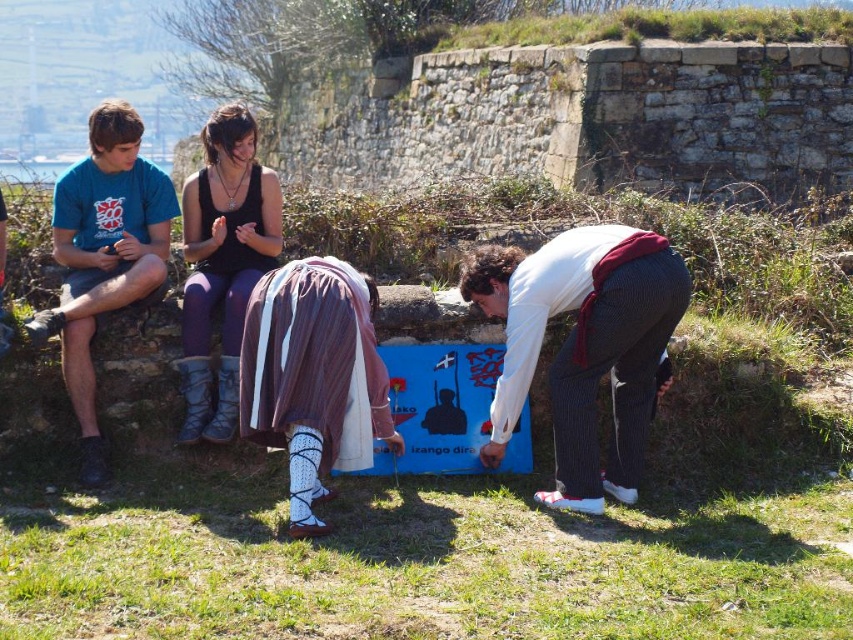
Which is above, green grass at lower center or matte black tank top at center?

matte black tank top at center is above.

Between green grass at lower center and matte black tank top at center, which one has less height?

Standing shorter between the two is matte black tank top at center.

Between point (498, 596) and point (210, 291), which one is positioned behind?

Positioned behind is point (210, 291).

This screenshot has width=853, height=640. In order to click on green grass at lower center in this screenshot , I will do `click(428, 508)`.

Does point (309, 406) lie behind point (85, 460)?

No, it is in front of (85, 460).

Measure the distance between point (271, 339) and camera.

They are 100.01 feet apart.

This screenshot has width=853, height=640. Identify the location of brown woven skirt at center. (312, 376).

Is white striped pants at lower center above blue cotton t-shirt at left?

Incorrect, white striped pants at lower center is not positioned above blue cotton t-shirt at left.

Which is in front, point (636, 260) or point (91, 432)?

Positioned in front is point (636, 260).

Is point (554, 273) farther from viewer compared to point (126, 145)?

That is False.

This screenshot has width=853, height=640. Find the location of `white striped pants at lower center`. white striped pants at lower center is located at coordinates (582, 346).